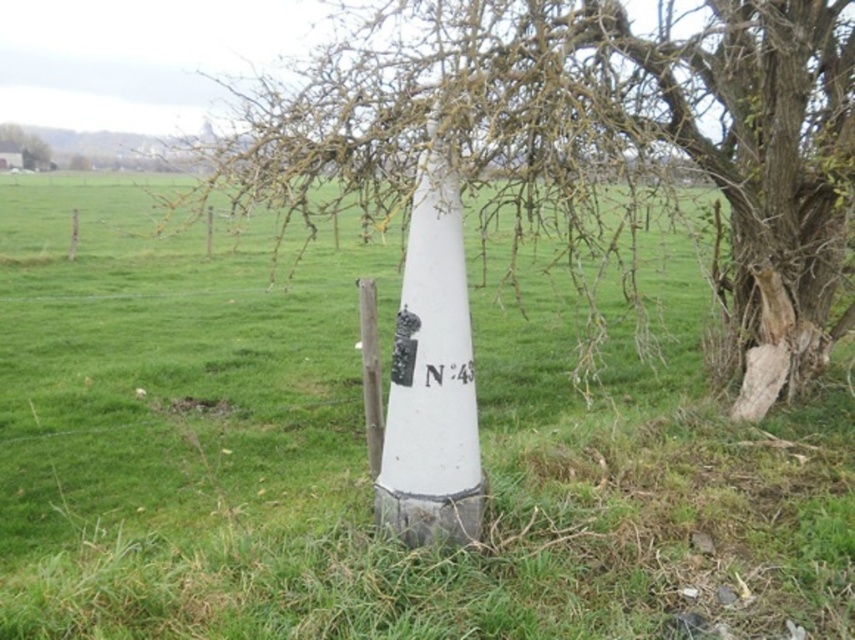
Consider the image. You are standing at point A, which is located at coordinates (591, 140) in the image. You want to walk towards the tree with rough bark. Which direction should you face to move directly towards it?

The smooth bark tree at center is located at point A, so to reach the tree with rough bark to the right, you should face towards the right direction.

You are a hiker trying to determine the best spot to set up your tent. You notice the brown bark tree at upper left and the black plastic sign at center. Which object is wider, and would this affect where you place your tent?

The brown bark tree at upper left is wider than the black plastic sign at center. This means the tree might cast more shade or require more space, so you should consider placing your tent away from the tree to avoid obstruction.